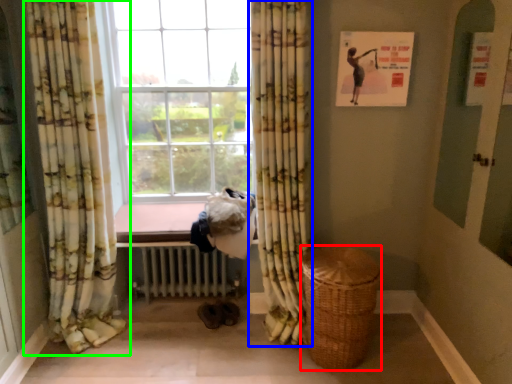
Question: Estimate the real-world distances between objects in this image. Which object is farther from basket (highlighted by a red box), curtain (highlighted by a blue box) or curtain (highlighted by a green box)?

Choices:
 (A) curtain
 (B) curtain

Answer: (B)